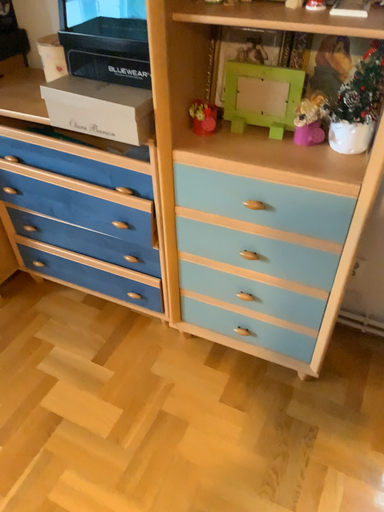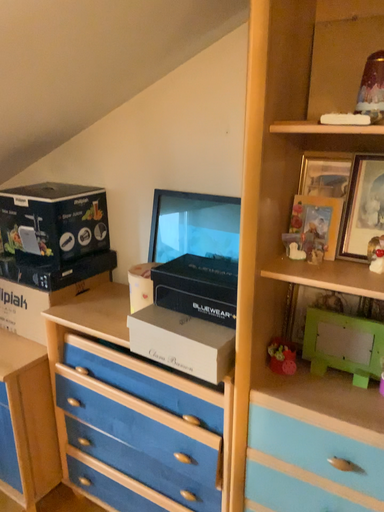
Question: How did the camera likely rotate when shooting the video?

Choices:
 (A) rotated downward
 (B) rotated upward

Answer: (B)